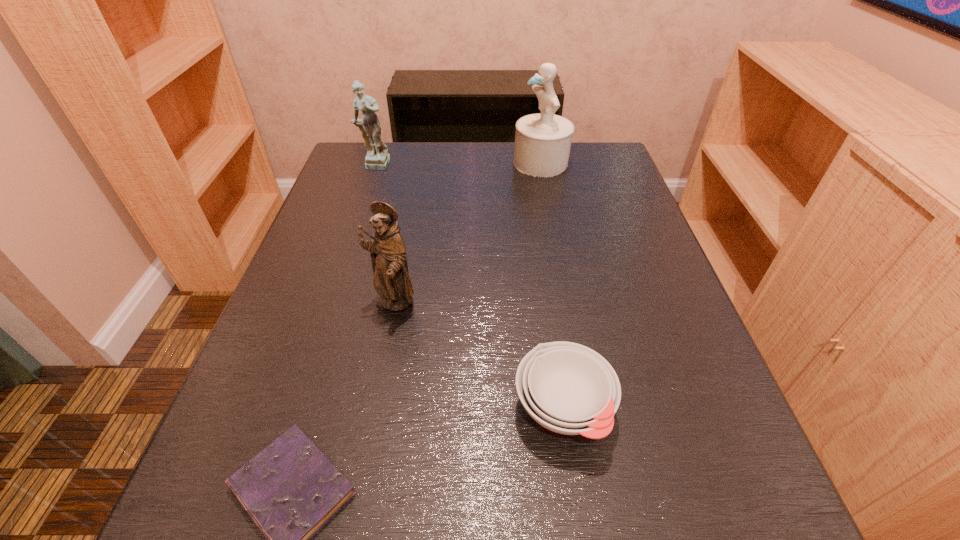
At what (x,y) coordinates should I click in order to perform the action: click on vacant space situated 0.190m on the back of the soup bowl. Please return your answer as a coordinate pair (x, y). This screenshot has width=960, height=540. Looking at the image, I should click on (543, 282).

The height and width of the screenshot is (540, 960). Identify the location of object at the left edge. (377, 158).

The width and height of the screenshot is (960, 540). I want to click on object that is positioned at the right edge, so coord(543,140).

The image size is (960, 540). Identify the location of object present at the far left corner. (377, 158).

Locate an element on the screen. object located at the far right corner is located at coordinates (543, 140).

The width and height of the screenshot is (960, 540). I want to click on free space at the far edge, so click(429, 167).

Locate an element on the screen. The width and height of the screenshot is (960, 540). vacant area at the near edge is located at coordinates (451, 489).

At what (x,y) coordinates should I click in order to perform the action: click on blank area at the left edge. Please return your answer as a coordinate pair (x, y). The width and height of the screenshot is (960, 540). Looking at the image, I should click on (372, 234).

Find the location of `free space at the right edge of the desktop`. free space at the right edge of the desktop is located at coordinates (623, 240).

In the image, there is a desktop. What are the coordinates of `free region at the far left corner` in the screenshot? It's located at (359, 144).